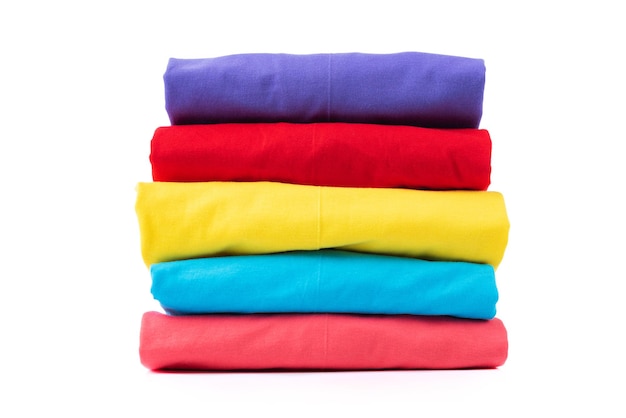
At what (x,y) coordinates should I click in order to perform the action: click on folded laundry. Please return your answer as a coordinate pair (x, y). The height and width of the screenshot is (418, 626). Looking at the image, I should click on (339, 75), (332, 137), (326, 197), (322, 263), (313, 327).